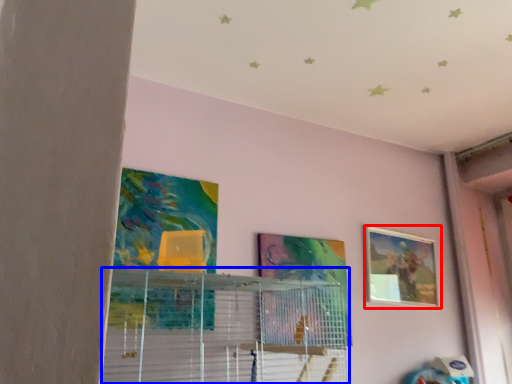
Question: Which object is closer to the camera taking this photo, picture frame (highlighted by a red box) or shelf (highlighted by a blue box)?

Choices:
 (A) picture frame
 (B) shelf

Answer: (B)